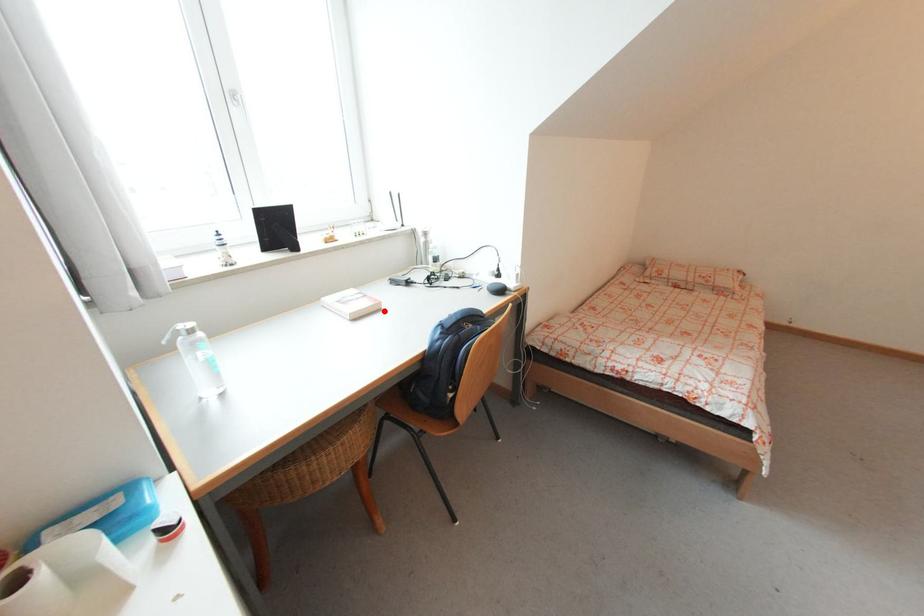
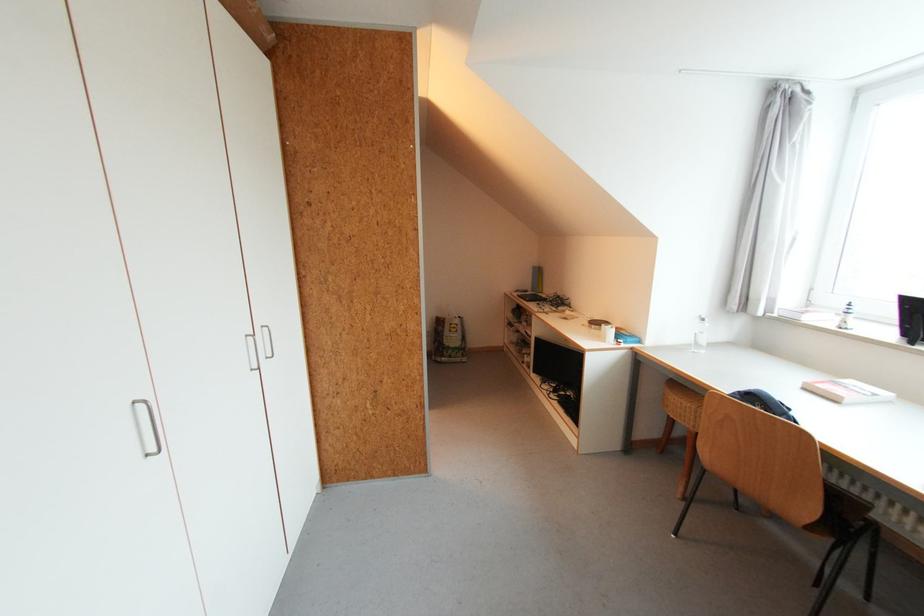
The point at the highlighted location is marked in the first image. Where is the corresponding point in the second image?

(841, 403)